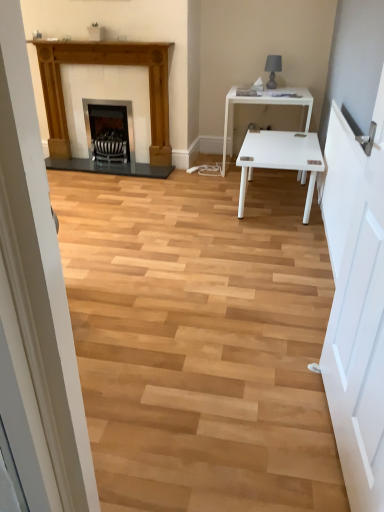
Identify the location of vacant space in front of wooden fireplace at left, the 2th fireplace from the right. This screenshot has width=384, height=512. (117, 185).